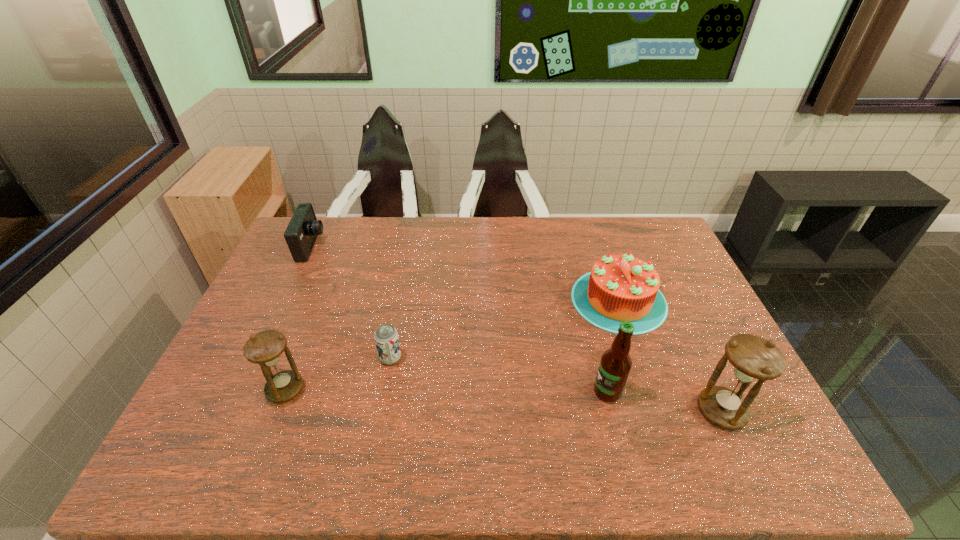
I want to click on vacant region at the far left corner of the desktop, so click(x=314, y=254).

The image size is (960, 540). What are the coordinates of `free space between the leftmost object and the second object from left to right` in the screenshot? It's located at (299, 318).

Find the location of a particular element. free space that is in between the farthest object and the third object from left to right is located at coordinates (351, 302).

The image size is (960, 540). I want to click on blank region between the shortest object and the taller hourglass, so click(556, 384).

This screenshot has width=960, height=540. I want to click on blank region between the second farthest object and the right hourglass, so click(x=670, y=355).

At what (x,y) coordinates should I click in order to perform the action: click on vacant space that's between the shortest object and the fifth nearest object. Please return your answer as a coordinate pair (x, y). This screenshot has width=960, height=540. Looking at the image, I should click on (505, 329).

Image resolution: width=960 pixels, height=540 pixels. I want to click on unoccupied position between the right hourglass and the beer bottle, so click(664, 401).

Locate an element on the screen. The height and width of the screenshot is (540, 960). vacant space in between the second farthest object and the right hourglass is located at coordinates (670, 355).

Locate an element on the screen. The height and width of the screenshot is (540, 960). unoccupied area between the beer bottle and the farthest object is located at coordinates (460, 319).

Locate an element on the screen. This screenshot has height=540, width=960. empty location between the fourth nearest object and the right hourglass is located at coordinates (556, 384).